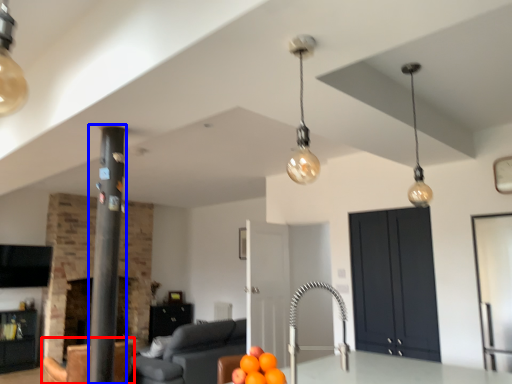
Question: Which object appears farthest to the camera in this image, armchair (highlighted by a red box) or pillar (highlighted by a blue box)?

Choices:
 (A) armchair
 (B) pillar

Answer: (A)